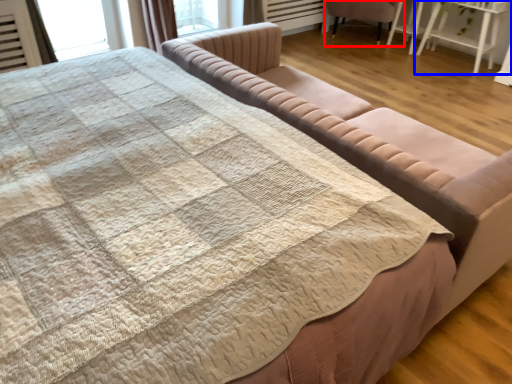
Question: Among these objects, which one is nearest to the camera, chair (highlighted by a red box) or table (highlighted by a blue box)?

Choices:
 (A) chair
 (B) table

Answer: (B)